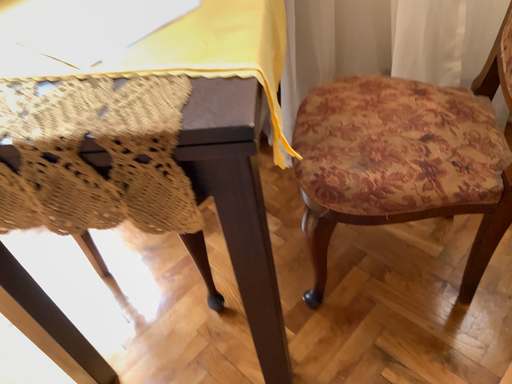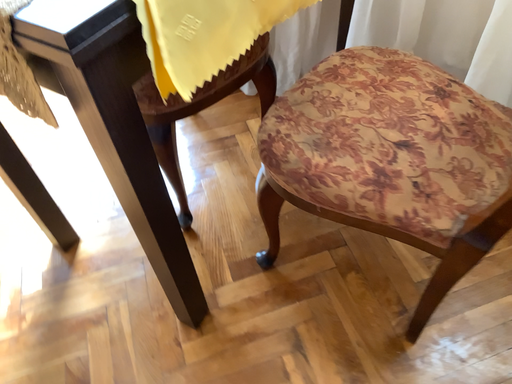
Question: Which way did the camera rotate in the video?

Choices:
 (A) rotated left
 (B) rotated right

Answer: (A)